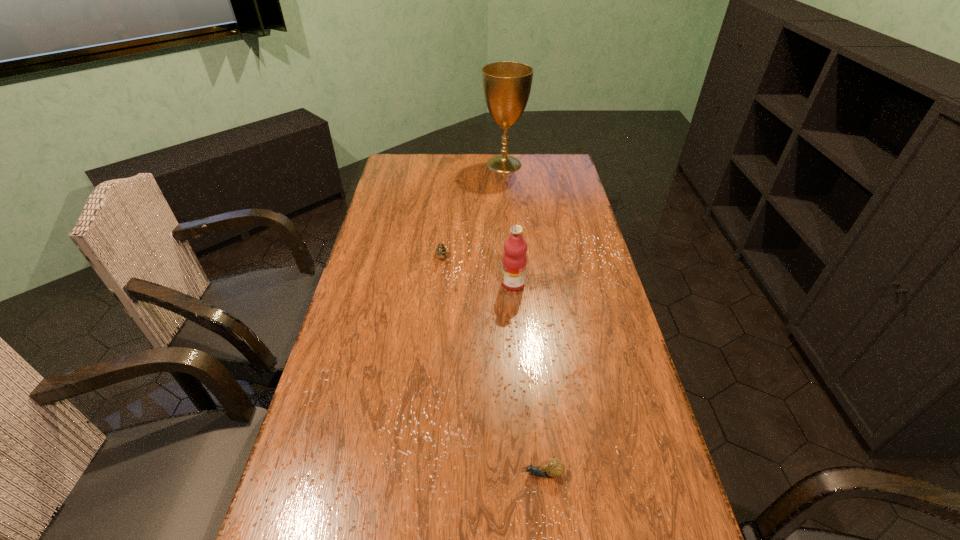
The width and height of the screenshot is (960, 540). Identify the location of the tallest object. (507, 85).

Where is `the farthest object`? The image size is (960, 540). the farthest object is located at coordinates (507, 85).

Identify the location of the second nearest object. Image resolution: width=960 pixels, height=540 pixels. (515, 247).

The height and width of the screenshot is (540, 960). Find the location of `fruit juice`. fruit juice is located at coordinates [515, 247].

Where is `the third tallest object`? This screenshot has height=540, width=960. the third tallest object is located at coordinates (441, 250).

You are a GUI agent. You are given a task and a screenshot of the screen. Output one action in this format:
    pyautogui.click(x=<x>, y=<y>)
    Task: Click on the taller escargot
    The image size is (960, 540).
    Given the screenshot: What is the action you would take?
    pyautogui.click(x=441, y=250)

Locate an element on the screen. the shorter escargot is located at coordinates (554, 468).

You are a GUI agent. You are given a task and a screenshot of the screen. Output one action in this format:
    pyautogui.click(x=<x>, y=<y>)
    Task: Click on the right escargot
    
    Given the screenshot: What is the action you would take?
    pyautogui.click(x=554, y=468)

Find the location of a particular element. vacant space situated on the front of the farthest object is located at coordinates (508, 213).

At what (x,y) coordinates should I click in order to perform the action: click on vacant position located 0.340m on the label of the fruit juice. Please return your answer as a coordinate pair (x, y). Looking at the image, I should click on (395, 284).